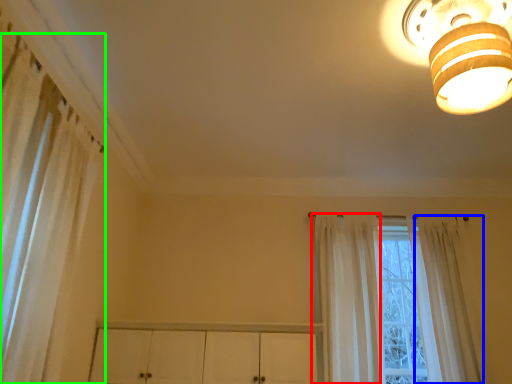
Question: Based on their relative distances, which object is farther from curtain (highlighted by a red box)? Choose from curtain (highlighted by a blue box) and curtain (highlighted by a green box).

Choices:
 (A) curtain
 (B) curtain

Answer: (B)